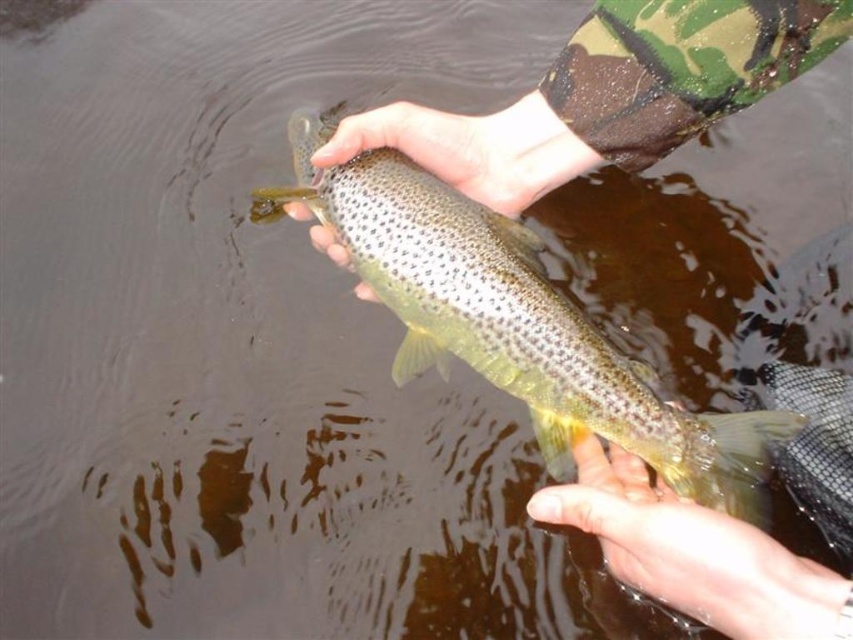
Question: Is smooth skin hand at lower right closer to camera compared to smooth skin hand at center?

Choices:
 (A) no
 (B) yes

Answer: (B)

Question: Which object appears farthest from the camera in this image?

Choices:
 (A) smooth skin hand at lower right
 (B) speckled goldfish at center
 (C) smooth skin hand at center

Answer: (C)

Question: Does smooth skin hand at lower right appear on the left side of smooth skin hand at center?

Choices:
 (A) no
 (B) yes

Answer: (A)

Question: Which object is closer to the camera taking this photo?

Choices:
 (A) speckled goldfish at center
 (B) smooth skin hand at lower right

Answer: (B)

Question: Estimate the real-world distances between objects in this image. Which object is closer to the smooth skin hand at lower right?

Choices:
 (A) speckled goldfish at center
 (B) smooth skin hand at center

Answer: (A)

Question: Is speckled goldfish at center to the right of smooth skin hand at lower right from the viewer's perspective?

Choices:
 (A) yes
 (B) no

Answer: (B)